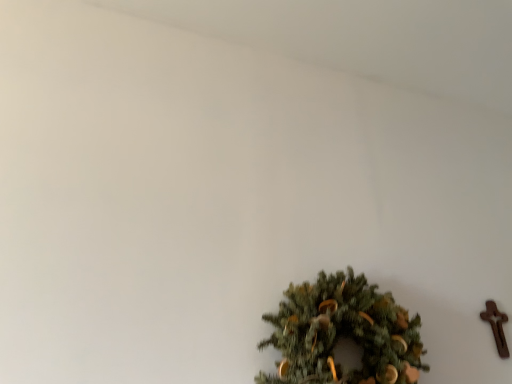
Find the location of a particular element. This screenshot has height=384, width=512. green matte wreath at lower center is located at coordinates (343, 334).

Describe the element at coordinates (343, 334) in the screenshot. I see `green matte wreath at lower center` at that location.

The image size is (512, 384). In order to click on green matte wreath at lower center in this screenshot , I will do `click(343, 334)`.